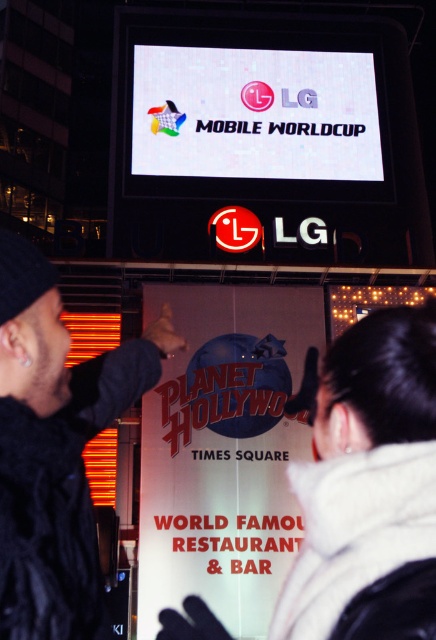
Is point (265, 596) positioned before point (17, 548)?

No, (265, 596) is further to viewer.

Identify the location of white paper sign at center. (224, 451).

This screenshot has width=436, height=640. In order to click on white paper sign at center in this screenshot , I will do `click(224, 451)`.

Can you confirm if black fuzzy hat at upper left is positioned above white glossy screen at upper center?

Actually, black fuzzy hat at upper left is below white glossy screen at upper center.

Can you confirm if black fuzzy hat at upper left is positioned below white glossy screen at upper center?

Yes.

Is point (71, 598) more distant than point (365, 173)?

No, (71, 598) is closer to viewer.

The image size is (436, 640). I want to click on black fuzzy hat at upper left, so click(x=54, y=449).

Does white paper sign at center have a lesser height compared to white glossy screen at upper center?

In fact, white paper sign at center may be taller than white glossy screen at upper center.

Is white paper sign at center thinner than white glossy screen at upper center?

Correct, white paper sign at center's width is less than white glossy screen at upper center's.

Locate an element on the screen. The image size is (436, 640). white paper sign at center is located at coordinates (224, 451).

I want to click on white paper sign at center, so click(x=224, y=451).